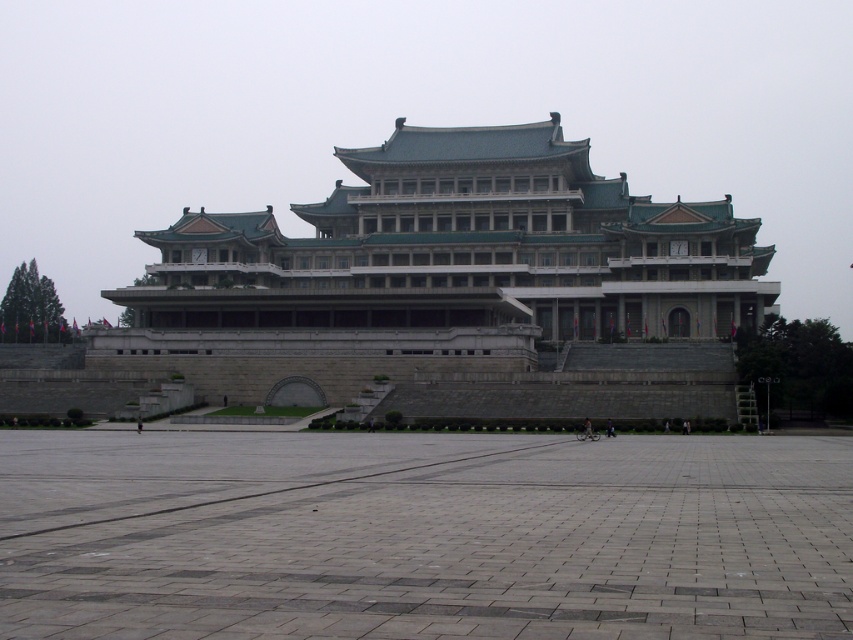
Question: Which object appears closest to the camera in this image?

Choices:
 (A) gray stone palace at center
 (B) gray concrete plaza at center

Answer: (B)

Question: In this image, where is gray concrete plaza at center located relative to gray stone palace at center?

Choices:
 (A) above
 (B) below

Answer: (B)

Question: Can you confirm if gray concrete plaza at center is positioned below gray stone palace at center?

Choices:
 (A) yes
 (B) no

Answer: (A)

Question: Where is gray concrete plaza at center located in relation to gray stone palace at center in the image?

Choices:
 (A) above
 (B) below

Answer: (B)

Question: Which of the following is the closest to the observer?

Choices:
 (A) gray stone palace at center
 (B) gray concrete plaza at center

Answer: (B)

Question: Among these objects, which one is nearest to the camera?

Choices:
 (A) gray stone palace at center
 (B) gray concrete plaza at center

Answer: (B)